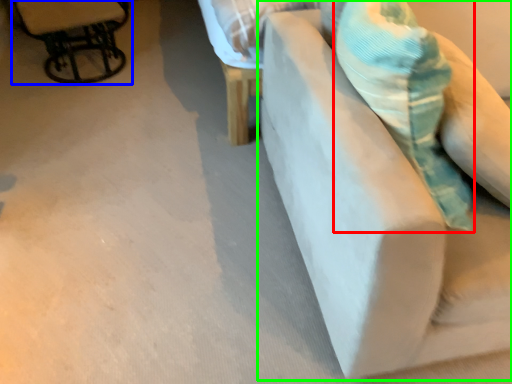
Question: Which is nearer to the throw pillow (highlighted by a red box)? chair (highlighted by a blue box) or furniture (highlighted by a green box).

Choices:
 (A) chair
 (B) furniture

Answer: (B)